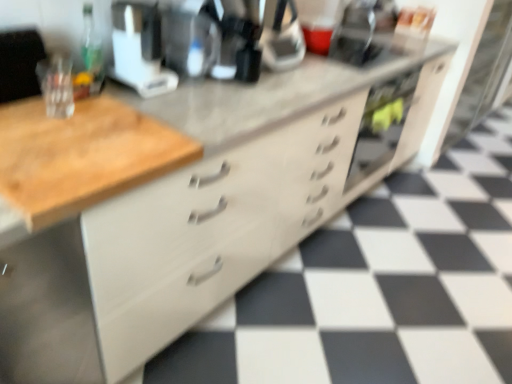
The height and width of the screenshot is (384, 512). I want to click on free point to the right of green glass bottle at upper left, so click(137, 92).